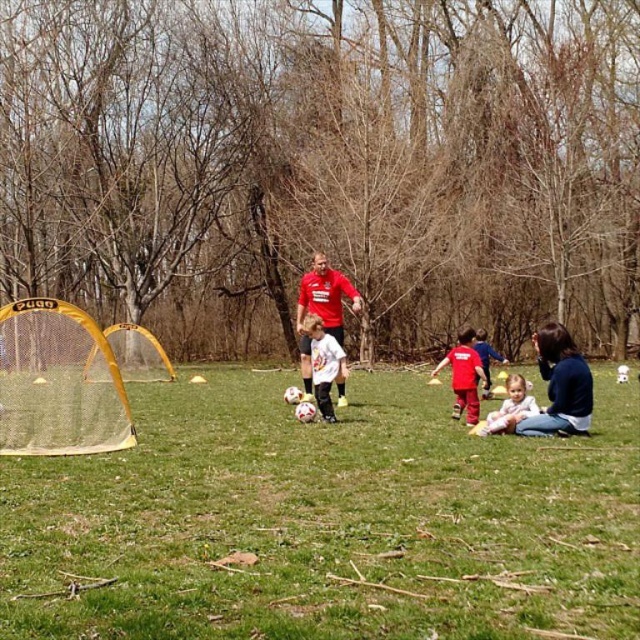
Question: Does matte red shirt at center appear under soft pink fabric at lower right?

Choices:
 (A) no
 (B) yes

Answer: (A)

Question: Based on their relative distances, which object is nearer to the green grass at center?

Choices:
 (A) soft pink fabric at lower right
 (B) blue cotton shirt at lower right
 (C) white matte soccer ball at center

Answer: (C)

Question: From the image, what is the correct spatial relationship of blue cotton shirt at lower right in relation to matte red shirt at center?

Choices:
 (A) above
 (B) below

Answer: (B)

Question: Which point is farther to the camera?

Choices:
 (A) (554, 401)
 (B) (248, 548)
 (C) (524, 413)

Answer: (C)

Question: Among these points, which one is farthest from the camera?

Choices:
 (A) (321, 282)
 (B) (554, 336)
 (C) (179, 529)

Answer: (A)

Question: Can you confirm if matte red shirt at center is positioned to the left of white matte soccer ball at center?

Choices:
 (A) yes
 (B) no

Answer: (A)